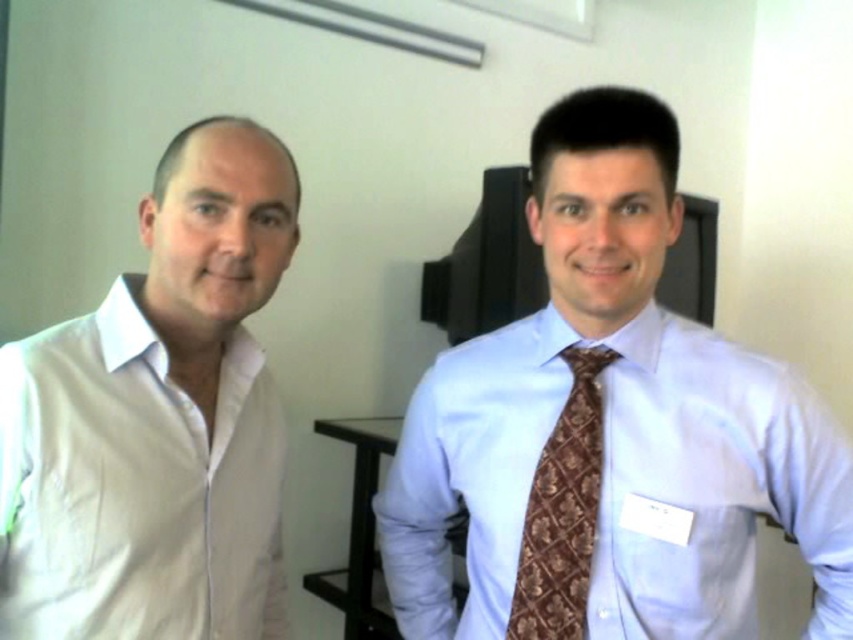
Question: Can you confirm if white cotton shirt at left is positioned below light blue cotton shirt at right?

Choices:
 (A) yes
 (B) no

Answer: (B)

Question: Does white cotton shirt at left appear over light blue cotton shirt at right?

Choices:
 (A) no
 (B) yes

Answer: (B)

Question: Which point is farther to the camera?

Choices:
 (A) (811, 568)
 (B) (241, 586)

Answer: (A)

Question: Which of these objects is positioned farthest from the light blue cotton shirt at right?

Choices:
 (A) brown textured tie at center
 (B) white cotton shirt at left

Answer: (B)

Question: Can you confirm if white cotton shirt at left is bigger than brown textured tie at center?

Choices:
 (A) yes
 (B) no

Answer: (A)

Question: Which point is closer to the camera?

Choices:
 (A) brown textured tie at center
 (B) white cotton shirt at left

Answer: (B)